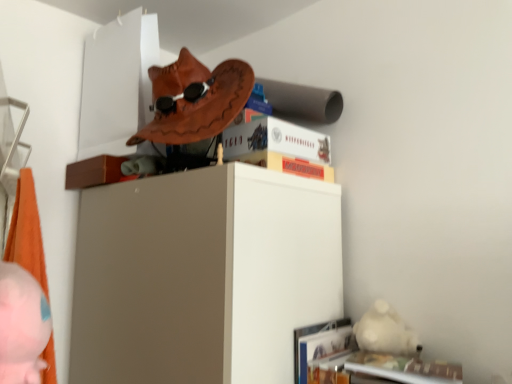
Describe the element at coordinates (275, 140) in the screenshot. This screenshot has width=512, height=384. I see `hardcover book at upper center, the 1th paperback book positioned from the top` at that location.

Locate an element on the screen. monopoly board game at upper center, which ranks as the 2th paperback book in top-to-bottom order is located at coordinates (288, 165).

Considering their positions, is pink plush toy at lower left located in front of or behind hardcover book at upper center, the 1th paperback book positioned from the top?

pink plush toy at lower left is in front of hardcover book at upper center, the 1th paperback book positioned from the top.

What's the angular difference between pink plush toy at lower left and hardcover book at upper center, the 1th paperback book positioned from the top,'s facing directions?

The angular difference between pink plush toy at lower left and hardcover book at upper center, the 1th paperback book positioned from the top, is 64.8 degrees.

Is point (31, 378) closer or farther from the camera than point (265, 119)?

Point (31, 378).

In the scene shown: Considering the sizes of objects pink plush toy at lower left and hardcover book at upper center, which ranks as the 2th paperback book in bottom-to-top order, in the image provided, who is taller, pink plush toy at lower left or hardcover book at upper center, which ranks as the 2th paperback book in bottom-to-top order,?

Standing taller between the two is pink plush toy at lower left.

From a real-world perspective, is monopoly board game at upper center, the 1th paperback book in the bottom-to-top sequence, located beneath pink plush toy at lower left?

No, from a real-world perspective, monopoly board game at upper center, the 1th paperback book in the bottom-to-top sequence, is not under pink plush toy at lower left.

There is a pink plush toy at lower left. Find the location of `the 1st paperback book above it (from a real-world perspective)`. the 1st paperback book above it (from a real-world perspective) is located at coordinates (288, 165).

Who is bigger, monopoly board game at upper center, the 1th paperback book in the bottom-to-top sequence, or pink plush toy at lower left?

Bigger between the two is monopoly board game at upper center, the 1th paperback book in the bottom-to-top sequence.

Do you think monopoly board game at upper center, the 1th paperback book in the bottom-to-top sequence, is within pink plush toy at lower left, or outside of it?

monopoly board game at upper center, the 1th paperback book in the bottom-to-top sequence, is outside pink plush toy at lower left.

Between hardcover book at upper center, which ranks as the 2th paperback book in bottom-to-top order, and pink plush toy at lower left, which one appears on the right side from the viewer's perspective?

hardcover book at upper center, which ranks as the 2th paperback book in bottom-to-top order.

Does hardcover book at upper center, the 1th paperback book positioned from the top, have a larger size compared to pink plush toy at lower left?

Indeed, hardcover book at upper center, the 1th paperback book positioned from the top, has a larger size compared to pink plush toy at lower left.

From a real-world perspective, relative to pink plush toy at lower left, is hardcover book at upper center, which ranks as the 2th paperback book in bottom-to-top order, vertically above or below?

hardcover book at upper center, which ranks as the 2th paperback book in bottom-to-top order, is above pink plush toy at lower left.

Is hardcover book at upper center, which ranks as the 2th paperback book in bottom-to-top order, not within pink plush toy at lower left?

Indeed, hardcover book at upper center, which ranks as the 2th paperback book in bottom-to-top order, is completely outside pink plush toy at lower left.

Can we say pink plush toy at lower left lies outside monopoly board game at upper center, the 1th paperback book in the bottom-to-top sequence?

Yes, pink plush toy at lower left is outside of monopoly board game at upper center, the 1th paperback book in the bottom-to-top sequence.

In the scene shown: Which object is closer to the camera, pink plush toy at lower left or monopoly board game at upper center, which ranks as the 2th paperback book in top-to-bottom order?

pink plush toy at lower left is in front.

Where is `person on the left of monopoly board game at upper center, the 1th paperback book in the bottom-to-top sequence`? Image resolution: width=512 pixels, height=384 pixels. person on the left of monopoly board game at upper center, the 1th paperback book in the bottom-to-top sequence is located at coordinates (22, 325).

Considering the positions of objects pink plush toy at lower left and monopoly board game at upper center, the 1th paperback book in the bottom-to-top sequence, in the image provided, who is more to the right, pink plush toy at lower left or monopoly board game at upper center, the 1th paperback book in the bottom-to-top sequence,?

monopoly board game at upper center, the 1th paperback book in the bottom-to-top sequence.

Could you tell me if hardcover book at upper center, the 1th paperback book positioned from the top, is facing monopoly board game at upper center, the 1th paperback book in the bottom-to-top sequence?

No.

From a real-world perspective, who is located lower, hardcover book at upper center, which ranks as the 2th paperback book in bottom-to-top order, or monopoly board game at upper center, the 1th paperback book in the bottom-to-top sequence?

monopoly board game at upper center, the 1th paperback book in the bottom-to-top sequence.

Is hardcover book at upper center, the 1th paperback book positioned from the top, not inside monopoly board game at upper center, which ranks as the 2th paperback book in top-to-bottom order?

hardcover book at upper center, the 1th paperback book positioned from the top, is positioned outside monopoly board game at upper center, which ranks as the 2th paperback book in top-to-bottom order.

Considering the points (320, 160) and (323, 180), which point is in front, point (320, 160) or point (323, 180)?

The point (323, 180) is in front.

Who is shorter, monopoly board game at upper center, which ranks as the 2th paperback book in top-to-bottom order, or hardcover book at upper center, which ranks as the 2th paperback book in bottom-to-top order?

monopoly board game at upper center, which ranks as the 2th paperback book in top-to-bottom order.

In the image, is monopoly board game at upper center, the 1th paperback book in the bottom-to-top sequence, positioned in front of or behind hardcover book at upper center, the 1th paperback book positioned from the top?

monopoly board game at upper center, the 1th paperback book in the bottom-to-top sequence, is in front of hardcover book at upper center, the 1th paperback book positioned from the top.

Considering the positions of objects monopoly board game at upper center, which ranks as the 2th paperback book in top-to-bottom order, and hardcover book at upper center, the 1th paperback book positioned from the top, in the image provided, who is more to the left, monopoly board game at upper center, which ranks as the 2th paperback book in top-to-bottom order, or hardcover book at upper center, the 1th paperback book positioned from the top,?

Positioned to the left is hardcover book at upper center, the 1th paperback book positioned from the top.

At what (x,y) coordinates should I click in order to perform the action: click on person that appears on the left of hardcover book at upper center, which ranks as the 2th paperback book in bottom-to-top order. Please return your answer as a coordinate pair (x, y). Looking at the image, I should click on (22, 325).

The width and height of the screenshot is (512, 384). What are the coordinates of `the 1st paperback book behind the pink plush toy at lower left` in the screenshot? It's located at (288, 165).

Looking at the image, which one is located further to hardcover book at upper center, which ranks as the 2th paperback book in bottom-to-top order, pink plush toy at lower left or monopoly board game at upper center, which ranks as the 2th paperback book in top-to-bottom order?

Among the two, pink plush toy at lower left is located further to hardcover book at upper center, which ranks as the 2th paperback book in bottom-to-top order.

Considering their positions, is pink plush toy at lower left positioned further to monopoly board game at upper center, which ranks as the 2th paperback book in top-to-bottom order, than hardcover book at upper center, which ranks as the 2th paperback book in bottom-to-top order?

pink plush toy at lower left lies further to monopoly board game at upper center, which ranks as the 2th paperback book in top-to-bottom order, than the other object.

Considering their positions, is hardcover book at upper center, the 1th paperback book positioned from the top, positioned closer to pink plush toy at lower left than monopoly board game at upper center, which ranks as the 2th paperback book in top-to-bottom order?

monopoly board game at upper center, which ranks as the 2th paperback book in top-to-bottom order.

When comparing their distances from pink plush toy at lower left, does monopoly board game at upper center, which ranks as the 2th paperback book in top-to-bottom order, or hardcover book at upper center, the 1th paperback book positioned from the top, seem closer?

monopoly board game at upper center, which ranks as the 2th paperback book in top-to-bottom order, is closer to pink plush toy at lower left.

Based on their spatial positions, is monopoly board game at upper center, the 1th paperback book in the bottom-to-top sequence, or pink plush toy at lower left closer to hardcover book at upper center, which ranks as the 2th paperback book in bottom-to-top order?

The object closer to hardcover book at upper center, which ranks as the 2th paperback book in bottom-to-top order, is monopoly board game at upper center, the 1th paperback book in the bottom-to-top sequence.

Looking at the image, which one is located further to monopoly board game at upper center, the 1th paperback book in the bottom-to-top sequence, hardcover book at upper center, the 1th paperback book positioned from the top, or pink plush toy at lower left?

pink plush toy at lower left is further to monopoly board game at upper center, the 1th paperback book in the bottom-to-top sequence.

This screenshot has width=512, height=384. Find the location of `paperback book between pink plush toy at lower left and hardcover book at upper center, the 1th paperback book positioned from the top, along the z-axis`. paperback book between pink plush toy at lower left and hardcover book at upper center, the 1th paperback book positioned from the top, along the z-axis is located at coordinates (288, 165).